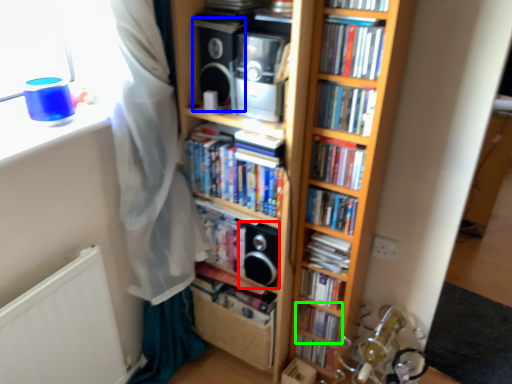
Question: Based on their relative distances, which object is farther from speaker (highlighted by a red box)? Choose from speaker (highlighted by a blue box) and book (highlighted by a green box).

Choices:
 (A) speaker
 (B) book

Answer: (A)